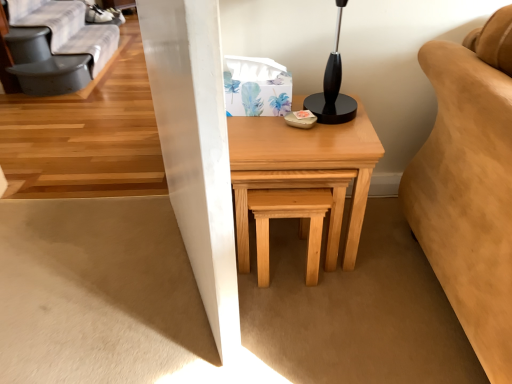
Find the location of a particular element. This screenshot has width=512, height=384. free spot in front of natural wood table at center is located at coordinates (315, 322).